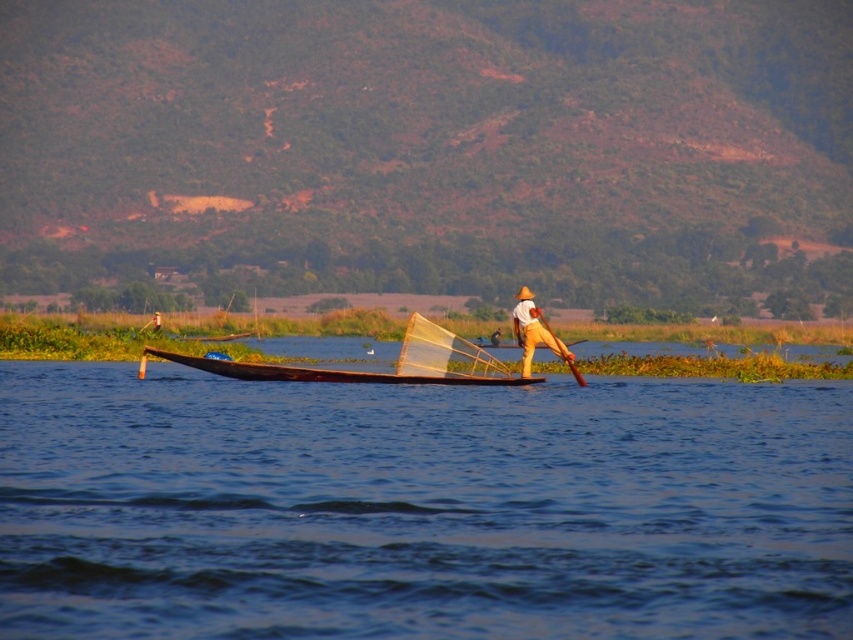
Who is positioned more to the left, wooden canoe at center or yellow fabric hat at center?

wooden canoe at center is more to the left.

Which is behind, point (241, 362) or point (525, 340)?

Positioned behind is point (241, 362).

Identify the location of wooden canoe at center. (x=317, y=372).

From the picture: Can you confirm if yellow fabric hat at center is positioned above wooden paddle at center?

Indeed, yellow fabric hat at center is positioned over wooden paddle at center.

Who is more distant from viewer, (x=531, y=365) or (x=572, y=372)?

Positioned behind is point (x=572, y=372).

This screenshot has width=853, height=640. In order to click on yellow fabric hat at center in this screenshot , I will do `click(532, 330)`.

Does blue wooden boat at center have a greater width compared to wooden paddle at center?

Yes.

How much distance is there between blue wooden boat at center and wooden paddle at center?

The distance of blue wooden boat at center from wooden paddle at center is 29.19 feet.

Does point (219, 404) come behind point (544, 326)?

No, (219, 404) is in front of (544, 326).

Locate an element on the screen. blue wooden boat at center is located at coordinates (421, 508).